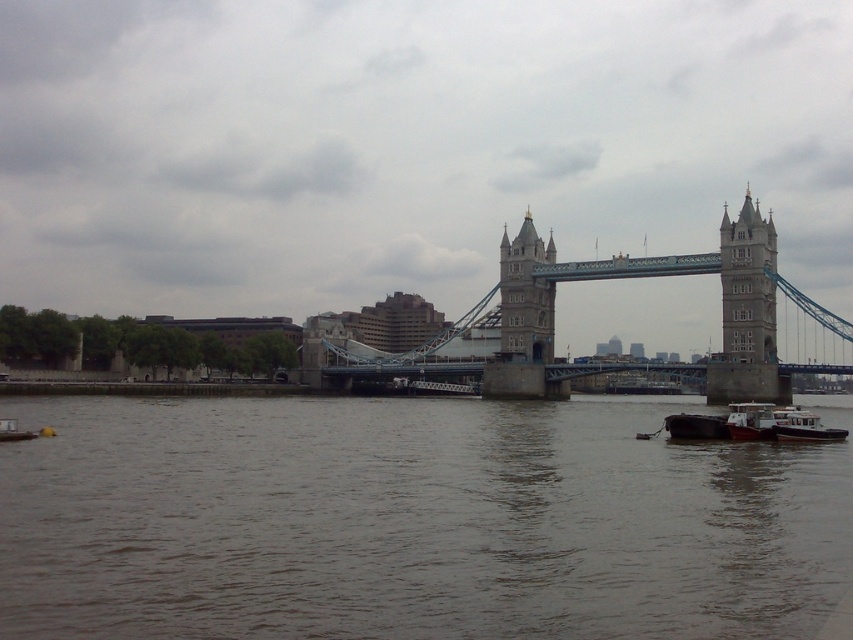
At what (x,y) coordinates should I click in order to perform the action: click on stone gray suspension bridge at center. Please return your answer as a coordinate pair (x, y). Image resolution: width=853 pixels, height=640 pixels. Looking at the image, I should click on (607, 278).

Does stone gray suspension bridge at center appear under stone tower at center?

Correct, stone gray suspension bridge at center is located below stone tower at center.

Does point (753, 348) lie behind point (531, 346)?

No, it is not.

Where is `stone gray suspension bridge at center`? The image size is (853, 640). stone gray suspension bridge at center is located at coordinates (607, 278).

Find the location of a particular element. This screenshot has height=640, width=853. brown water at lower center is located at coordinates (412, 522).

Is point (524, 253) closer to camera compared to point (785, 420)?

That is False.

Can you confirm if stone gray suspension bridge at center is smaller than white plastic boat at lower right?

No.

Consider the image. Measure the distance between point [611,260] and camera.

Point [611,260] and camera are 131.70 meters apart.

The image size is (853, 640). I want to click on stone gray suspension bridge at center, so click(607, 278).